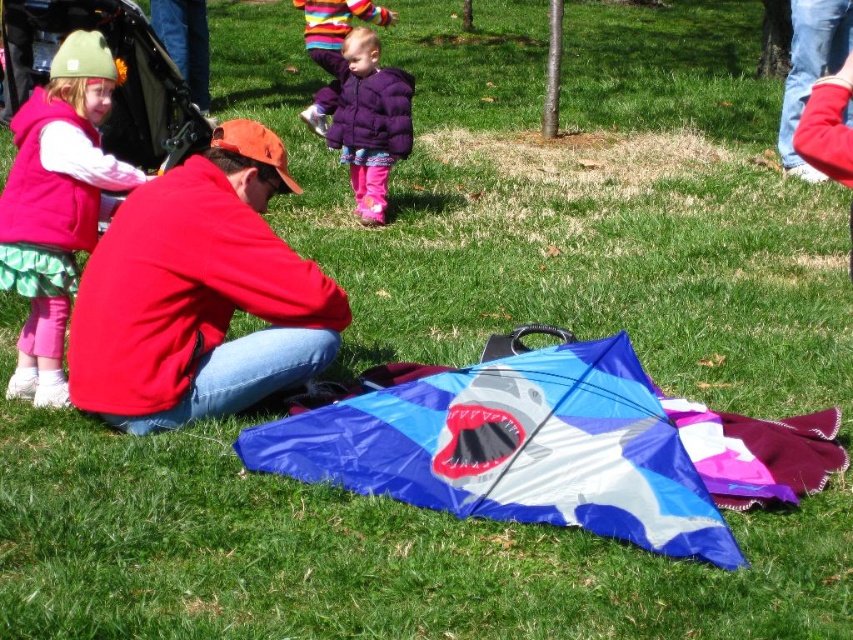
Question: Does blue fabric kite at center lie behind purple puffy coat at center?

Choices:
 (A) no
 (B) yes

Answer: (A)

Question: Is blue fabric kite at center above purple puffy coat at center?

Choices:
 (A) yes
 (B) no

Answer: (B)

Question: Considering the relative positions of red fleece jacket at center and matte pink vest at left in the image provided, where is red fleece jacket at center located with respect to matte pink vest at left?

Choices:
 (A) above
 (B) below

Answer: (B)

Question: Among these objects, which one is farthest from the camera?

Choices:
 (A) red fleece jacket at center
 (B) blue fabric kite at center
 (C) purple puffy coat at center

Answer: (C)

Question: Which object is farther from the camera taking this photo?

Choices:
 (A) matte pink vest at left
 (B) blue fabric kite at center

Answer: (A)

Question: Which of these objects is positioned closest to the purple puffy coat at center?

Choices:
 (A) blue fabric kite at center
 (B) red fleece jacket at center

Answer: (B)